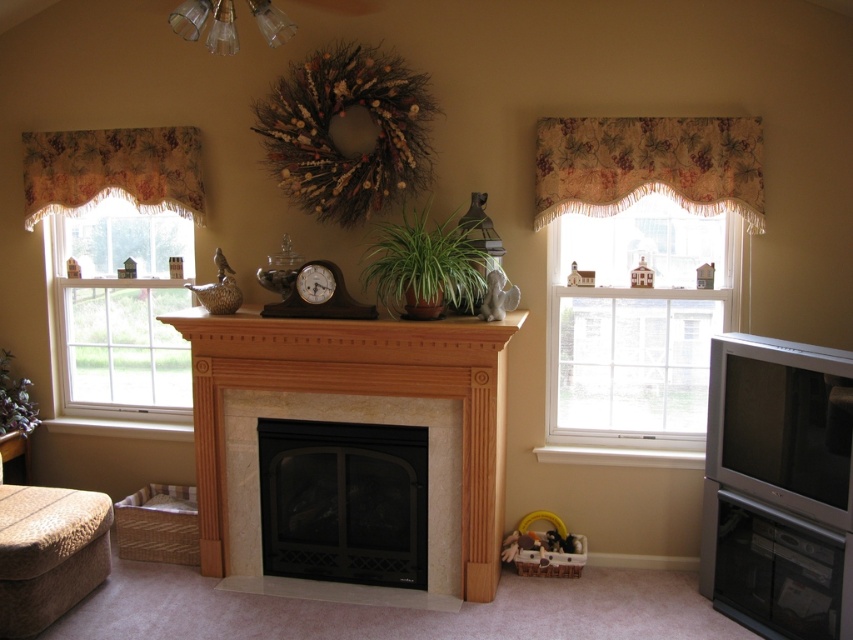
This screenshot has height=640, width=853. What are the coordinates of `brown fabric ottoman at lower left` in the screenshot? It's located at (48, 554).

Where is `brown fabric ottoman at lower left`? The image size is (853, 640). brown fabric ottoman at lower left is located at coordinates (48, 554).

Is light wood/matte fireplace at center behind green matte plant at center?

No, light wood/matte fireplace at center is closer to the viewer.

Does light wood/matte fireplace at center appear over green matte plant at center?

Actually, light wood/matte fireplace at center is below green matte plant at center.

Who is more forward, (x=466, y=493) or (x=502, y=248)?

Point (x=466, y=493) is more forward.

The image size is (853, 640). I want to click on light wood/matte fireplace at center, so click(x=363, y=400).

Describe the element at coordinates (363, 400) in the screenshot. The image size is (853, 640). I see `light wood/matte fireplace at center` at that location.

Can you confirm if light wood/matte fireplace at center is positioned below brown fabric ottoman at lower left?

No.

At what (x,y) coordinates should I click in order to perform the action: click on light wood/matte fireplace at center. Please return your answer as a coordinate pair (x, y). The height and width of the screenshot is (640, 853). Looking at the image, I should click on (363, 400).